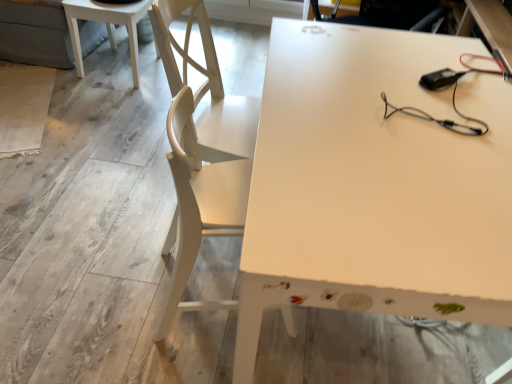
In order to click on blank space to the left of white matte table at center, which is the second table from back to front in this screenshot , I will do `click(110, 247)`.